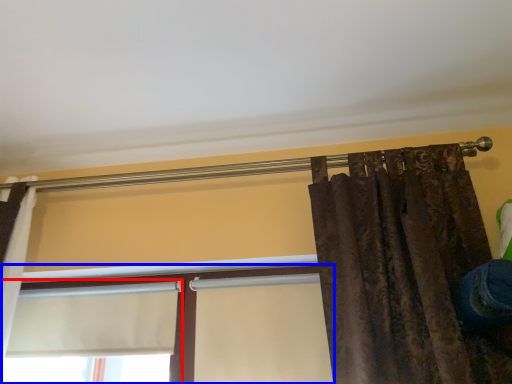
Question: Which point is closer to the camera, window (highlighted by a red box) or window (highlighted by a blue box)?

Choices:
 (A) window
 (B) window

Answer: (B)